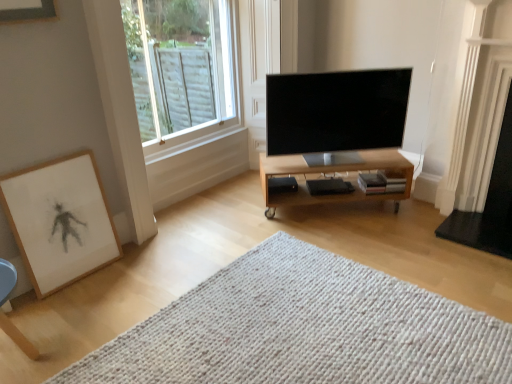
At what (x,y) coordinates should I click in order to perform the action: click on vacant space situated on the left part of white glossy fireplace at right. Please return your answer as a coordinate pair (x, y). Looking at the image, I should click on (416, 226).